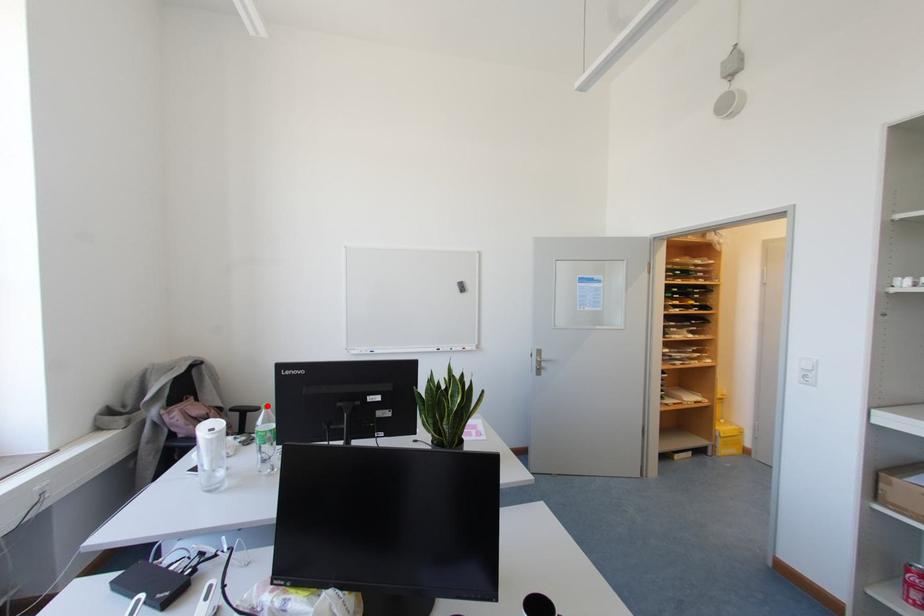
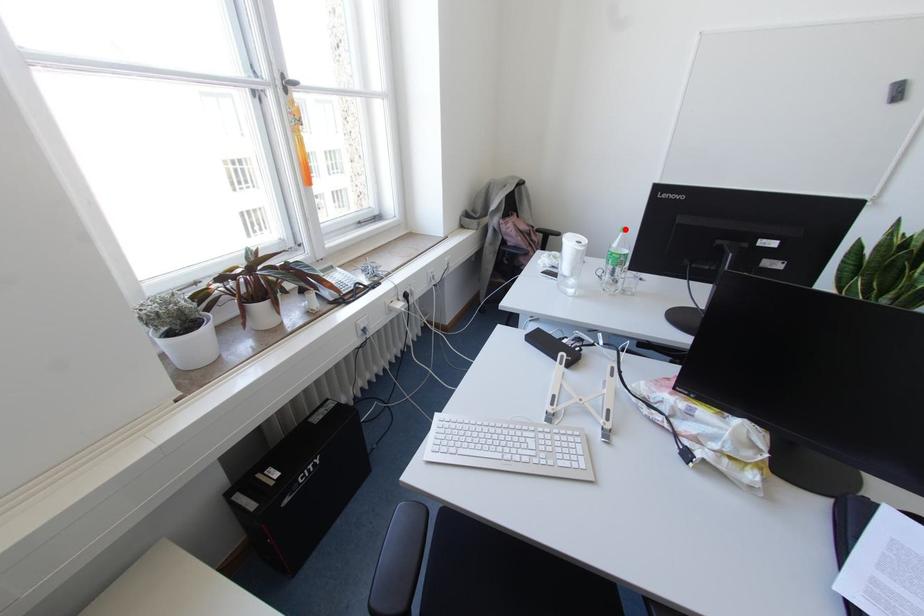
I am providing you with two images of the same scene from different viewpoints. A red point is marked on the first image and another point is marked on the second image. Do the highlighted points in image1 and image2 indicate the same real-world spot?

Yes